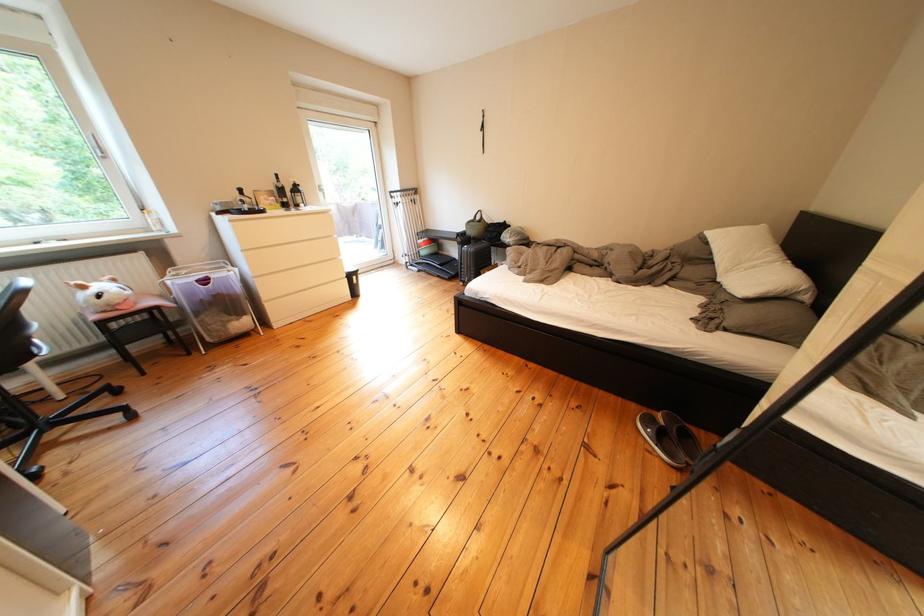
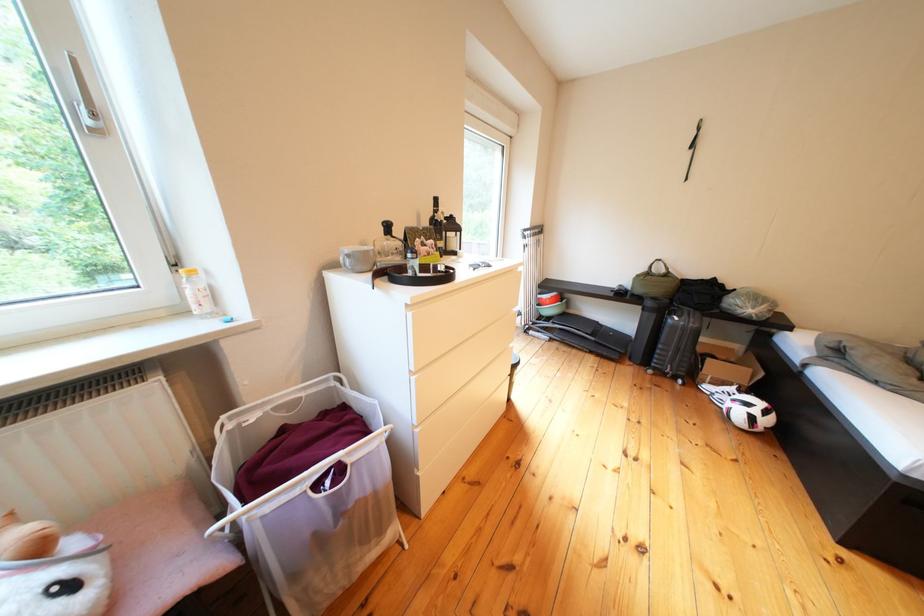
The images are taken continuously from a first-person perspective. In which direction are you moving?

The cameraman walked toward left, forward.